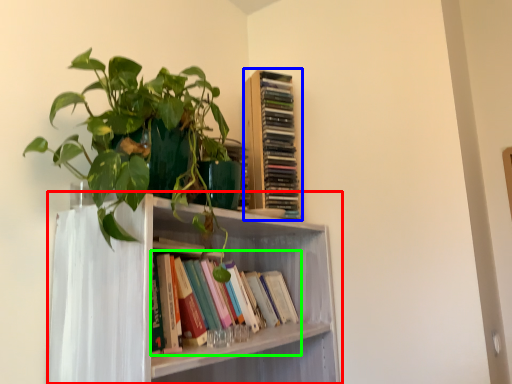
Question: Estimate the real-world distances between objects in this image. Which object is farther from shelf (highlighted by a red box), book (highlighted by a blue box) or book (highlighted by a green box)?

Choices:
 (A) book
 (B) book

Answer: (A)